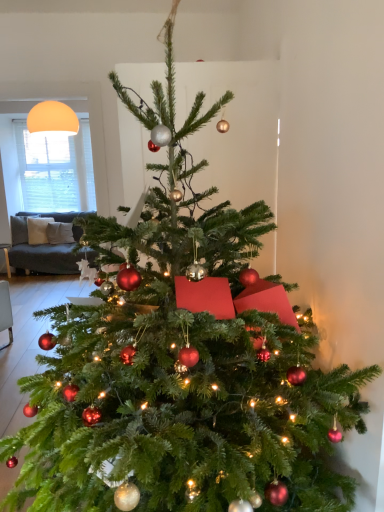
This screenshot has height=512, width=384. Describe the element at coordinates (52, 119) in the screenshot. I see `matte orange sphere at upper left` at that location.

At what (x,y) coordinates should I click in order to perform the action: click on matte orange sphere at upper left. Please return your answer as a coordinate pair (x, y). The width and height of the screenshot is (384, 512). Looking at the image, I should click on (52, 119).

Image resolution: width=384 pixels, height=512 pixels. Describe the element at coordinates (56, 170) in the screenshot. I see `white matte window screen at upper left` at that location.

What is the approximate width of white matte window screen at upper left?

The width of white matte window screen at upper left is 6.84 inches.

Find the location of a particular element. The image size is (384, 512). white matte window screen at upper left is located at coordinates (56, 170).

At what (x,y) coordinates should I click in order to perform the action: click on matte orange sphere at upper left. Please return your answer as a coordinate pair (x, y). The height and width of the screenshot is (512, 384). Looking at the image, I should click on (52, 119).

Which is more to the left, matte orange sphere at upper left or white matte window screen at upper left?

white matte window screen at upper left.

Between matte orange sphere at upper left and white matte window screen at upper left, which one is positioned in front?

matte orange sphere at upper left is more forward.

Which is closer to the camera, (x=70, y=118) or (x=46, y=200)?

Point (x=70, y=118) is closer to the camera than point (x=46, y=200).

In the scene shown: From the image's perspective, does matte orange sphere at upper left appear higher than white matte window screen at upper left?

Yes, from the image's perspective, matte orange sphere at upper left is over white matte window screen at upper left.

From a real-world perspective, which is physically above, matte orange sphere at upper left or white matte window screen at upper left?

matte orange sphere at upper left, from a real-world perspective.

Is matte orange sphere at upper left wider than white matte window screen at upper left?

Correct, the width of matte orange sphere at upper left exceeds that of white matte window screen at upper left.

Who is shorter, matte orange sphere at upper left or white matte window screen at upper left?

matte orange sphere at upper left.

Who is smaller, matte orange sphere at upper left or white matte window screen at upper left?

matte orange sphere at upper left.

Can we say matte orange sphere at upper left lies outside white matte window screen at upper left?

Yes, matte orange sphere at upper left is located beyond the bounds of white matte window screen at upper left.

Is matte orange sphere at upper left next to white matte window screen at upper left?

No, matte orange sphere at upper left is not beside white matte window screen at upper left.

Based on the photo, does matte orange sphere at upper left turn towards white matte window screen at upper left?

No, matte orange sphere at upper left is not oriented towards white matte window screen at upper left.

How far apart are matte orange sphere at upper left and white matte window screen at upper left?

They are 71.45 centimeters apart.

Image resolution: width=384 pixels, height=512 pixels. I want to click on lamp above the white matte window screen at upper left (from a real-world perspective), so click(52, 119).

Is white matte window screen at upper left to the left or to the right of matte orange sphere at upper left in the image?

From the image, it's evident that white matte window screen at upper left is to the left of matte orange sphere at upper left.

Relative to matte orange sphere at upper left, is white matte window screen at upper left in front or behind?

In the image, white matte window screen at upper left appears behind matte orange sphere at upper left.

Is point (87, 196) less distant than point (45, 103)?

No.

From the image's perspective, is white matte window screen at upper left on matte orange sphere at upper left?

Actually, white matte window screen at upper left appears below matte orange sphere at upper left in the image.

From a real-world perspective, which object rests below the other?

white matte window screen at upper left is physically lower.

Which object is thinner, white matte window screen at upper left or matte orange sphere at upper left?

white matte window screen at upper left.

From the picture: Who is taller, white matte window screen at upper left or matte orange sphere at upper left?

Standing taller between the two is white matte window screen at upper left.

Between white matte window screen at upper left and matte orange sphere at upper left, which one has smaller size?

matte orange sphere at upper left.

Choose the correct answer: Is white matte window screen at upper left inside matte orange sphere at upper left or outside it?

white matte window screen at upper left is located beyond the bounds of matte orange sphere at upper left.

Is white matte window screen at upper left beside matte orange sphere at upper left?

No, white matte window screen at upper left is not beside matte orange sphere at upper left.

Is white matte window screen at upper left oriented away from matte orange sphere at upper left?

white matte window screen at upper left does not have its back to matte orange sphere at upper left.

Can you tell me how much white matte window screen at upper left and matte orange sphere at upper left differ in facing direction?

The facing directions of white matte window screen at upper left and matte orange sphere at upper left are 2 degrees apart.

Measure the distance from white matte window screen at upper left to matte orange sphere at upper left.

white matte window screen at upper left and matte orange sphere at upper left are 28.13 inches apart.

Locate an element on the screen. This screenshot has height=512, width=384. lamp in front of the white matte window screen at upper left is located at coordinates [52, 119].

Where is `lamp lying above the white matte window screen at upper left (from the image's perspective)`? lamp lying above the white matte window screen at upper left (from the image's perspective) is located at coordinates (52, 119).

You are a GUI agent. You are given a task and a screenshot of the screen. Output one action in this format:
    pyautogui.click(x=<x>, y=<y>)
    Task: Click on the lamp on the right of the white matte window screen at upper left
    The image size is (384, 512).
    Given the screenshot: What is the action you would take?
    pyautogui.click(x=52, y=119)